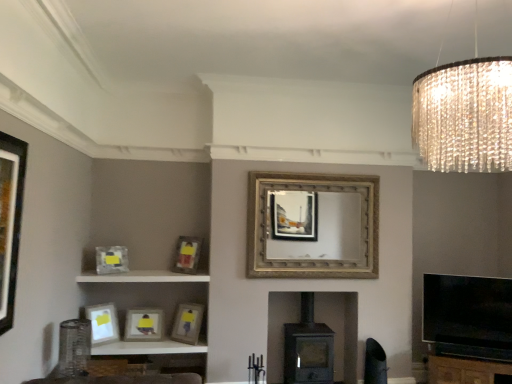
What are the coordinates of `blank space situated above gold textured mirror at center, which is the seventh picture frame from left to right (from a real-world perspective)` in the screenshot? It's located at (318, 176).